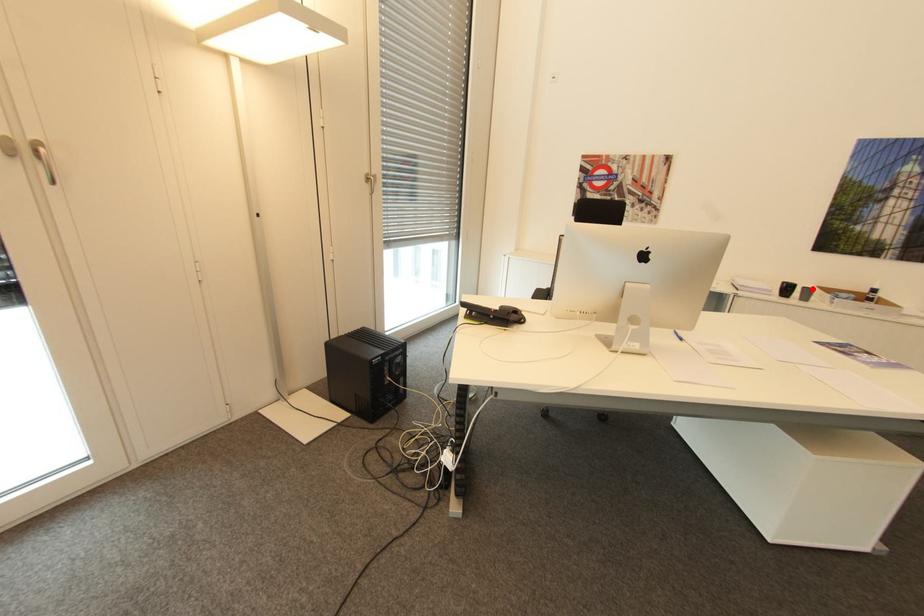
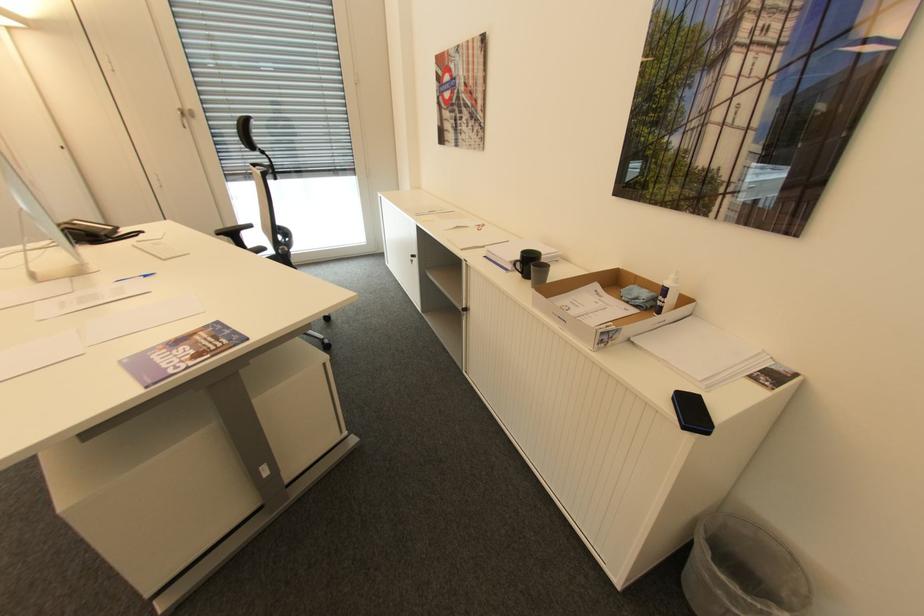
Locate, in the second image, the point that corresponds to the highlighted location in the first image.

(550, 268)